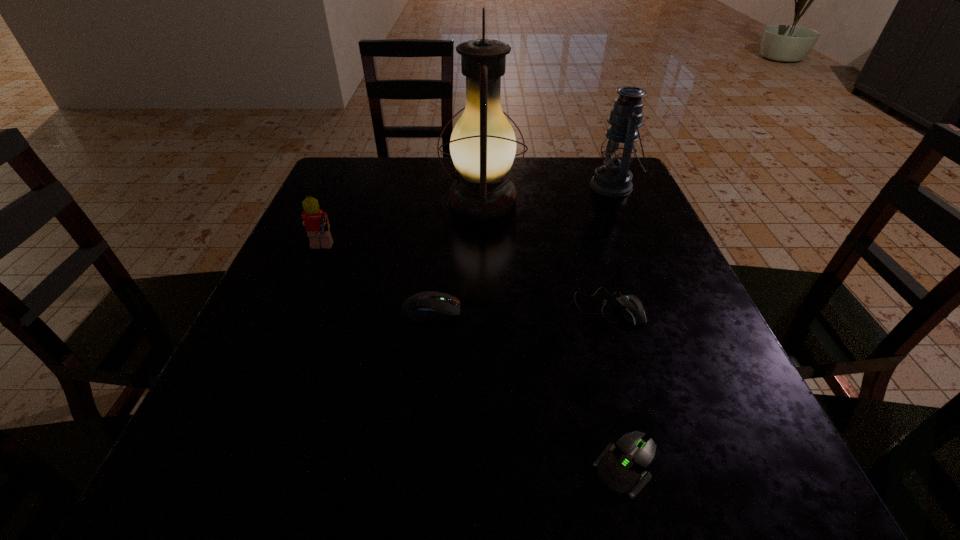
Locate an element on the screen. This screenshot has height=540, width=960. vacant region that satisfies the following two spatial constraints: 1. on the front-facing side of the lantern; 2. on the front side of the tallest object is located at coordinates (620, 201).

I want to click on vacant region that satisfies the following two spatial constraints: 1. on the button of the nearest computer mouse; 2. on the left side of the tallest computer mouse, so click(414, 466).

Identify the location of vacant point that satisfies the following two spatial constraints: 1. on the front side of the nearest object; 2. on the left side of the tallest object. This screenshot has width=960, height=540. (484, 466).

Locate an element on the screen. The width and height of the screenshot is (960, 540). vacant space that satisfies the following two spatial constraints: 1. on the front-facing side of the second tallest object; 2. on the front side of the oil lamp is located at coordinates (620, 201).